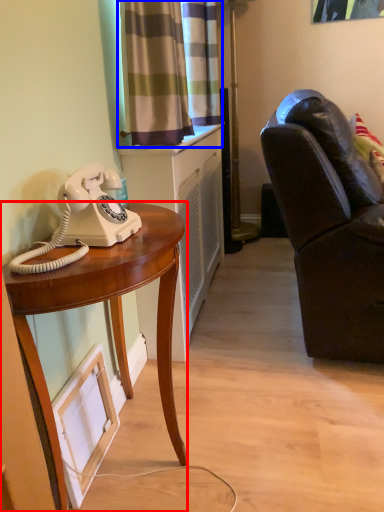
Question: Which object appears closest to the camera in this image, desk (highlighted by a red box) or curtain (highlighted by a blue box)?

Choices:
 (A) desk
 (B) curtain

Answer: (A)